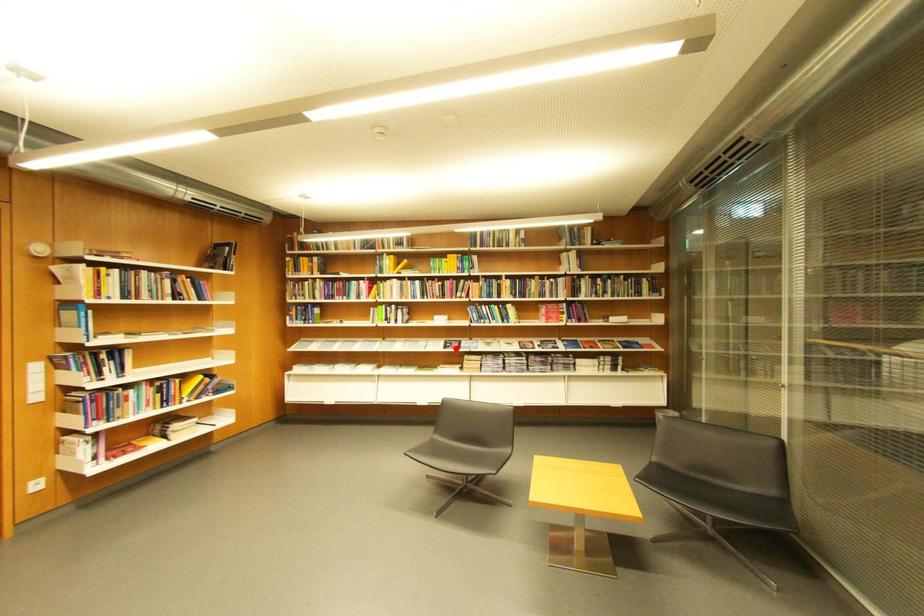
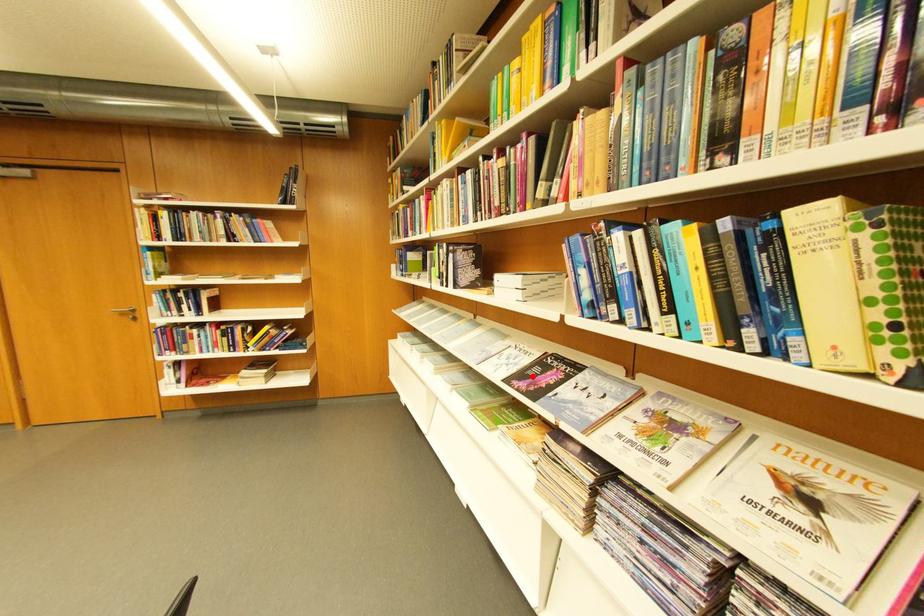
I am providing you with two images of the same scene from different viewpoints. A red point is marked on the first image and another point is marked on the second image. Is the marked point in image1 the same physical position as the marked point in image2?

Yes